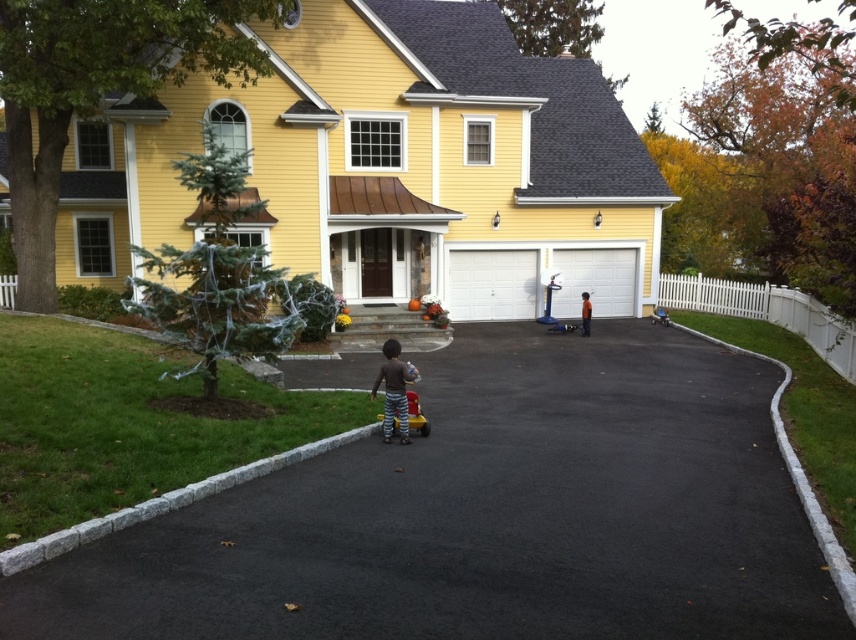
You are a parent trying to find your child who is playing on the black asphalt driveway at center. You see the plastic red toy car at center nearby. Which object is bigger in size?

The black asphalt driveway at center is larger in size compared to the plastic red toy car at center.

You are a parent trying to retrieve your child from the driveway. The plastic red toy car at center and orange cotton shirt at center are in your line of sight. How far apart are these two items?

The plastic red toy car at center and orange cotton shirt at center are 41.58 feet apart.